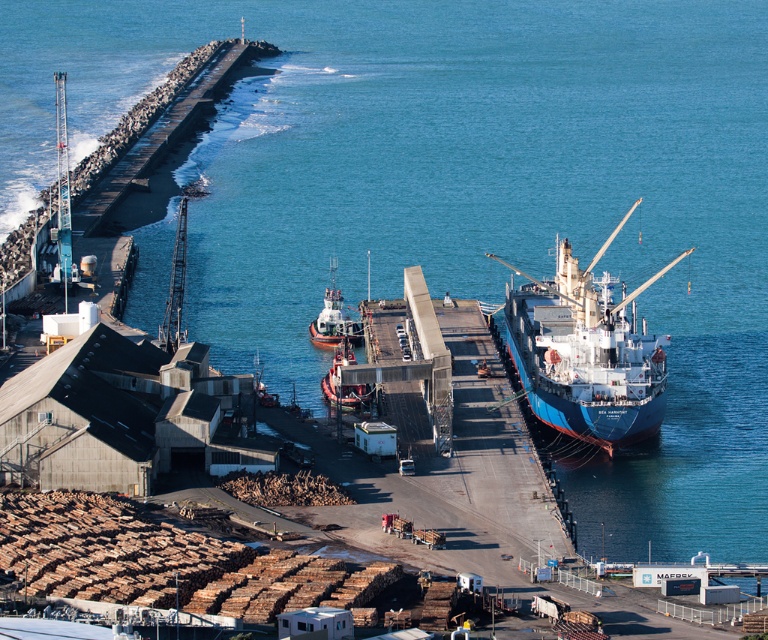
Does point (330, 324) come behind point (323, 378)?

Yes, point (330, 324) is farther from viewer.

How much distance is there between metallic gray tugboat at center and smooth white tugboat at center?

They are 24.95 meters apart.

Who is more distant from viewer, (x=316, y=339) or (x=348, y=390)?

Positioned behind is point (x=316, y=339).

The width and height of the screenshot is (768, 640). In order to click on metallic gray tugboat at center in this screenshot , I will do `click(333, 317)`.

Does point (604, 432) come closer to viewer compared to point (363, 397)?

That is True.

Does blue matte cargo ship at right lie in front of smooth white tugboat at center?

Yes, blue matte cargo ship at right is closer to the viewer.

Which is behind, point (634, 355) or point (320, 380)?

Positioned behind is point (320, 380).

The width and height of the screenshot is (768, 640). I want to click on blue matte cargo ship at right, so click(x=586, y=352).

Is point (553, 323) positioned after point (320, 330)?

No, (553, 323) is closer to viewer.

Is blue matte cargo ship at right wider than metallic gray tugboat at center?

Yes, blue matte cargo ship at right is wider than metallic gray tugboat at center.

Where is `blue matte cargo ship at right`? The width and height of the screenshot is (768, 640). blue matte cargo ship at right is located at coordinates (586, 352).